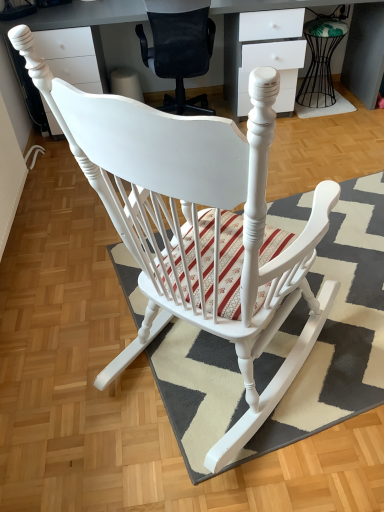
What do you see at coordinates (179, 48) in the screenshot?
I see `white mesh office chair at center` at bounding box center [179, 48].

Measure the distance between metallic wire stool at upper right and camera.

metallic wire stool at upper right and camera are 9.51 feet apart from each other.

Locate an element on the screen. This screenshot has height=512, width=384. white mesh office chair at center is located at coordinates (179, 48).

Is white mesh office chair at center next to metallic wire stool at upper right?

No, white mesh office chair at center is not in contact with metallic wire stool at upper right.

From a real-world perspective, is white mesh office chair at center positioned above or below metallic wire stool at upper right?

Clearly, from a real-world perspective, white mesh office chair at center is above metallic wire stool at upper right.

How different are the orientations of white mesh office chair at center and metallic wire stool at upper right in degrees?

The angle between the facing direction of white mesh office chair at center and the facing direction of metallic wire stool at upper right is 180 degrees.

At what (x,y) coordinates should I click in order to perform the action: click on feeding chair that is above the white mesh office chair at center (from the image's perspective). Please return your answer as a coordinate pair (x, y). Looking at the image, I should click on (322, 57).

Is point (175, 23) positioned behind point (105, 84)?

No.

Is white mesh office chair at center in front of or behind white glossy desk at upper center in the image?

white mesh office chair at center is positioned closer to the viewer than white glossy desk at upper center.

In the scene shown: From a real-world perspective, is white mesh office chair at center physically below white glossy desk at upper center?

Incorrect, from a real-world perspective, white mesh office chair at center is higher than white glossy desk at upper center.

Is white mesh office chair at center oriented away from white glossy desk at upper center?

Yes, white mesh office chair at center is facing away from white glossy desk at upper center.

What's the angular difference between metallic wire stool at upper right and textured gray rug at center, which appears as the 1th doormat when viewed from the front,'s facing directions?

The facing directions of metallic wire stool at upper right and textured gray rug at center, which appears as the 1th doormat when viewed from the front, are 105 degrees apart.

In the image, is metallic wire stool at upper right positioned in front of or behind textured gray rug at center, which appears as the 1th doormat when viewed from the front?

Visually, metallic wire stool at upper right is located behind textured gray rug at center, which appears as the 1th doormat when viewed from the front.

From a real-world perspective, which object rests below the other?

textured gray rug at center, placed as the 1th doormat when sorted from bottom to top, from a real-world perspective.

From the picture: Is textured gray rug at center, which appears as the 1th doormat when viewed from the front, at the back of metallic wire stool at upper right?

That's not correct — metallic wire stool at upper right is not looking away from textured gray rug at center, which appears as the 1th doormat when viewed from the front.

Does point (330, 335) lie in front of point (336, 104)?

Yes, point (330, 335) is closer to viewer.

Does textured gray rug at center, marked as the 2th doormat in a back-to-front arrangement, have a lesser height compared to white woven mat at lower right, marked as the first doormat in a back-to-front arrangement?

Indeed, textured gray rug at center, marked as the 2th doormat in a back-to-front arrangement, has a lesser height compared to white woven mat at lower right, marked as the first doormat in a back-to-front arrangement.

Is textured gray rug at center, marked as the 2th doormat in a back-to-front arrangement, surrounding white woven mat at lower right, arranged as the second doormat when viewed from the front?

No, white woven mat at lower right, arranged as the second doormat when viewed from the front, is located outside of textured gray rug at center, marked as the 2th doormat in a back-to-front arrangement.

Is textured gray rug at center, which appears as the 1th doormat when viewed from the front, touching white woven mat at lower right, arranged as the second doormat when viewed from the front?

No, textured gray rug at center, which appears as the 1th doormat when viewed from the front, is not making contact with white woven mat at lower right, arranged as the second doormat when viewed from the front.

Considering the sizes of objects textured gray rug at center, the second doormat when ordered from top to bottom, and metallic wire stool at upper right in the image provided, who is bigger, textured gray rug at center, the second doormat when ordered from top to bottom, or metallic wire stool at upper right?

With larger size is textured gray rug at center, the second doormat when ordered from top to bottom.

Is textured gray rug at center, the second doormat when ordered from top to bottom, at the right side of metallic wire stool at upper right?

Incorrect, textured gray rug at center, the second doormat when ordered from top to bottom, is not on the right side of metallic wire stool at upper right.

Do you think textured gray rug at center, which appears as the 1th doormat when viewed from the front, is within metallic wire stool at upper right, or outside of it?

textured gray rug at center, which appears as the 1th doormat when viewed from the front, exists outside the volume of metallic wire stool at upper right.

What are the coordinates of `feeding chair located on the right of textured gray rug at center, which appears as the 1th doormat when viewed from the front` in the screenshot? It's located at (322, 57).

Choose the correct answer: Is white woven mat at lower right, marked as the first doormat in a back-to-front arrangement, inside white mesh office chair at center or outside it?

white woven mat at lower right, marked as the first doormat in a back-to-front arrangement, is located beyond the bounds of white mesh office chair at center.

From the picture: Is white woven mat at lower right, the first doormat positioned from the top, placed right next to white mesh office chair at center?

No, white woven mat at lower right, the first doormat positioned from the top, is not touching white mesh office chair at center.

In the image, is white woven mat at lower right, arranged as the second doormat when viewed from the front, on the left side or the right side of white mesh office chair at center?

In the image, white woven mat at lower right, arranged as the second doormat when viewed from the front, appears on the right side of white mesh office chair at center.

Does white mesh office chair at center have a lesser height compared to white woven mat at lower right, positioned as the 2th doormat in bottom-to-top order?

Incorrect, the height of white mesh office chair at center does not fall short of that of white woven mat at lower right, positioned as the 2th doormat in bottom-to-top order.

Considering the sizes of objects white mesh office chair at center and white woven mat at lower right, the first doormat positioned from the top, in the image provided, who is wider, white mesh office chair at center or white woven mat at lower right, the first doormat positioned from the top,?

white woven mat at lower right, the first doormat positioned from the top, is wider.

Is there a large distance between white mesh office chair at center and white woven mat at lower right, marked as the first doormat in a back-to-front arrangement?

No, white mesh office chair at center is not far away from white woven mat at lower right, marked as the first doormat in a back-to-front arrangement.

Which object is closer to the camera taking this photo, white mesh office chair at center or white woven mat at lower right, arranged as the second doormat when viewed from the front?

white mesh office chair at center.

At what (x,y) coordinates should I click in order to perform the action: click on chair to the left of metallic wire stool at upper right. Please return your answer as a coordinate pair (x, y). Looking at the image, I should click on (179, 48).

In order to click on desk that appears behind the white mesh office chair at center in this screenshot , I will do `click(65, 64)`.

When comparing their distances from textured gray rug at center, the second doormat when ordered from top to bottom, does white woven mat at lower right, marked as the first doormat in a back-to-front arrangement, or metallic wire stool at upper right seem further?

The object further to textured gray rug at center, the second doormat when ordered from top to bottom, is metallic wire stool at upper right.

Considering their positions, is white woven mat at lower right, arranged as the second doormat when viewed from the front, positioned further to white glossy desk at upper center than white mesh office chair at center?

Among the two, white woven mat at lower right, arranged as the second doormat when viewed from the front, is located further to white glossy desk at upper center.

Looking at the image, which one is located closer to white woven mat at lower right, arranged as the second doormat when viewed from the front, white mesh office chair at center or white glossy desk at upper center?

Based on the image, white mesh office chair at center appears to be nearer to white woven mat at lower right, arranged as the second doormat when viewed from the front.

When comparing their distances from white woven mat at lower right, arranged as the second doormat when viewed from the front, does white glossy desk at upper center or textured gray rug at center, marked as the 2th doormat in a back-to-front arrangement, seem closer?

Among the two, white glossy desk at upper center is located nearer to white woven mat at lower right, arranged as the second doormat when viewed from the front.

Looking at the image, which one is located closer to metallic wire stool at upper right, textured gray rug at center, the second doormat when ordered from top to bottom, or white glossy desk at upper center?

white glossy desk at upper center is closer to metallic wire stool at upper right.

Which object lies further to the anchor point white woven mat at lower right, arranged as the second doormat when viewed from the front, metallic wire stool at upper right or white glossy desk at upper center?

Among the two, white glossy desk at upper center is located further to white woven mat at lower right, arranged as the second doormat when viewed from the front.

Looking at this image, from the image, which object appears to be farther from textured gray rug at center, marked as the 2th doormat in a back-to-front arrangement, white mesh office chair at center or white glossy desk at upper center?

Among the two, white glossy desk at upper center is located further to textured gray rug at center, marked as the 2th doormat in a back-to-front arrangement.

Estimate the real-world distances between objects in this image. Which object is closer to white mesh office chair at center, white woven mat at lower right, arranged as the second doormat when viewed from the front, or metallic wire stool at upper right?

The object closer to white mesh office chair at center is metallic wire stool at upper right.

This screenshot has width=384, height=512. Find the location of `desk between white mesh office chair at center and white woven mat at lower right, positioned as the 2th doormat in bottom-to-top order`. desk between white mesh office chair at center and white woven mat at lower right, positioned as the 2th doormat in bottom-to-top order is located at coordinates (65, 64).

The image size is (384, 512). Find the location of `feeding chair between textured gray rug at center, the second doormat when ordered from top to bottom, and white woven mat at lower right, the first doormat positioned from the top, along the z-axis`. feeding chair between textured gray rug at center, the second doormat when ordered from top to bottom, and white woven mat at lower right, the first doormat positioned from the top, along the z-axis is located at coordinates (322, 57).

You are a GUI agent. You are given a task and a screenshot of the screen. Output one action in this format:
    pyautogui.click(x=<x>, y=<y>)
    Task: Click on the feeding chair situated between white mesh office chair at center and white woven mat at lower right, marked as the first doormat in a back-to-front arrangement, from left to right
    
    Given the screenshot: What is the action you would take?
    pyautogui.click(x=322, y=57)

Find the location of a particular element. This screenshot has height=512, width=384. feeding chair between white glossy desk at upper center and white woven mat at lower right, marked as the first doormat in a back-to-front arrangement, in the horizontal direction is located at coordinates (x=322, y=57).